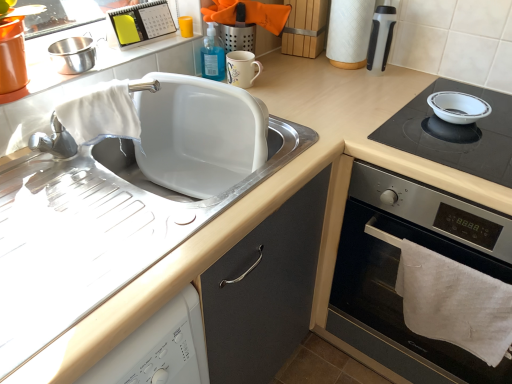
Locate an element on the screen. vacant space to the right of matte black thermos at upper right, positioned as the 1th appliance in right-to-left order is located at coordinates (410, 79).